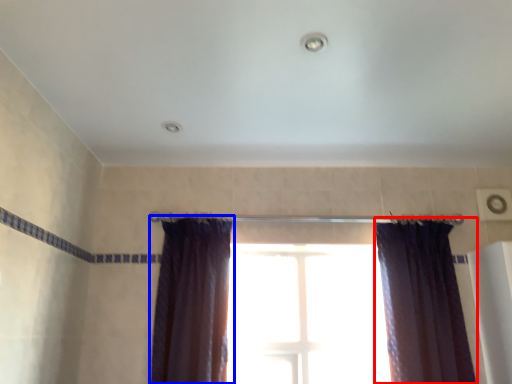
Question: Which object is closer to the camera taking this photo, curtain (highlighted by a red box) or curtain (highlighted by a blue box)?

Choices:
 (A) curtain
 (B) curtain

Answer: (B)